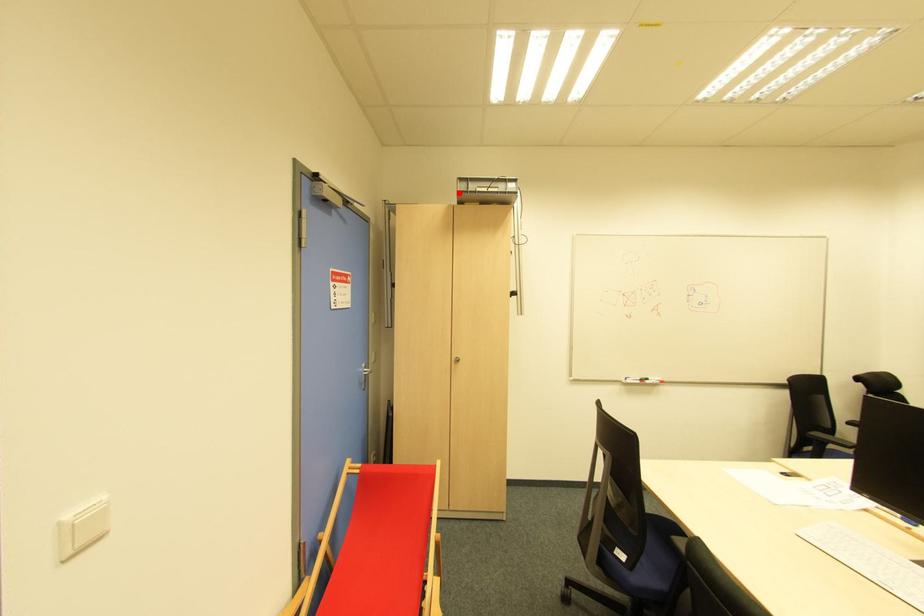
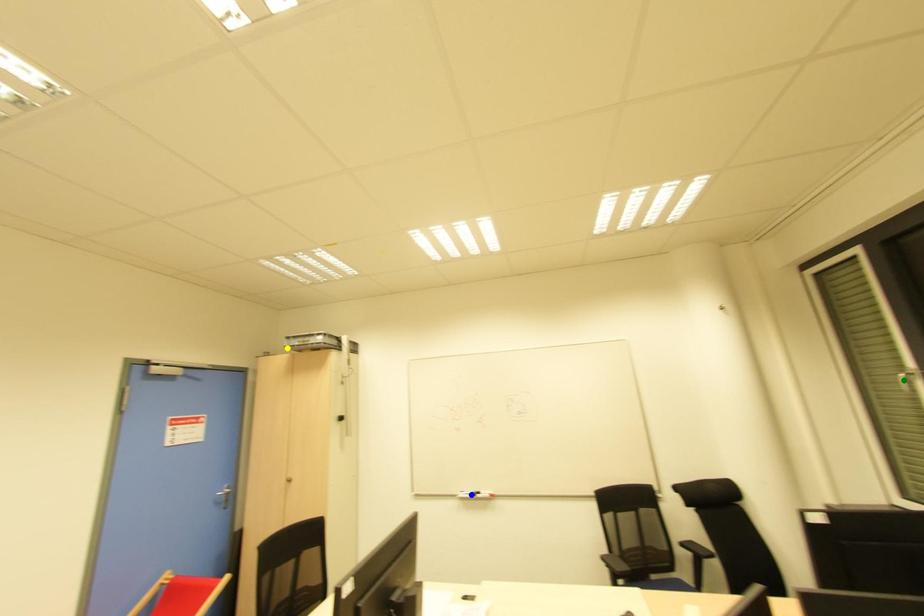
Question: I am providing you with two images of the same scene from different viewpoints. A red point is marked on the first image. You are given multiple points on the second image. Which mark in image 2 goes with the point in image 1?

Choices:
 (A) green point
 (B) yellow point
 (C) blue point

Answer: (B)